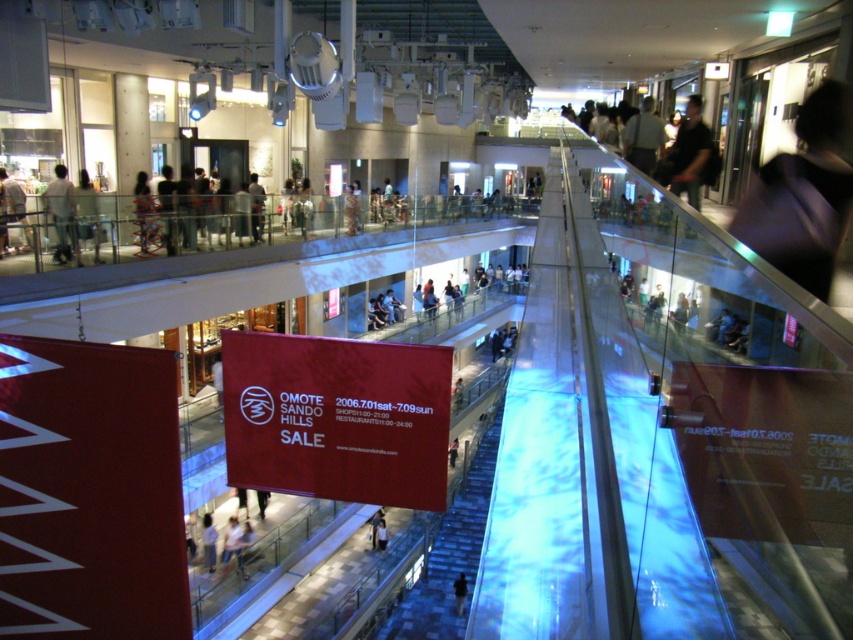
This screenshot has width=853, height=640. What do you see at coordinates (61, 212) in the screenshot?
I see `light brown leather jacket at upper left` at bounding box center [61, 212].

Who is taller, light brown leather jacket at upper left or light brown leather jacket at lower center?

Standing taller between the two is light brown leather jacket at upper left.

Between point (53, 189) and point (213, 564), which one is positioned behind?

Positioned behind is point (213, 564).

Identify the location of light brown leather jacket at upper left. Image resolution: width=853 pixels, height=640 pixels. (61, 212).

The width and height of the screenshot is (853, 640). Describe the element at coordinates (444, 548) in the screenshot. I see `translucent glass escalator at center` at that location.

Between point (381, 611) and point (438, 333), which one is positioned in front?

Point (381, 611) is more forward.

Does point (463, 467) come closer to viewer compared to point (428, 332)?

Yes, point (463, 467) is in front of point (428, 332).

The image size is (853, 640). What are the coordinates of `translucent glass escalator at center` in the screenshot? It's located at (444, 548).

Does light brown leather jacket at lower center appear on the left side of dark blue fabric at center?

Indeed, light brown leather jacket at lower center is positioned on the left side of dark blue fabric at center.

Is light brown leather jacket at lower center positioned before dark blue fabric at center?

That is True.

Between point (212, 563) and point (463, 579), which one is positioned behind?

Point (463, 579)

Locate an element on the screen. The width and height of the screenshot is (853, 640). light brown leather jacket at lower center is located at coordinates 209,541.